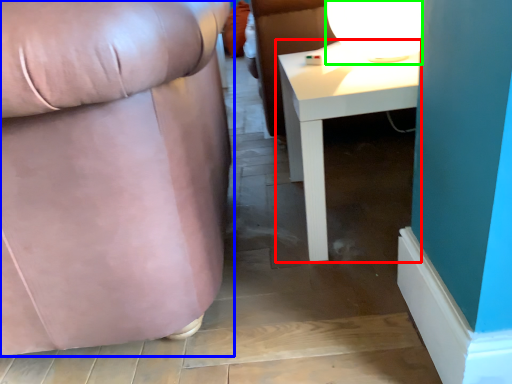
Question: Estimate the real-world distances between objects in this image. Which object is closer to table (highlighted by a red box), chair (highlighted by a blue box) or table lamp (highlighted by a green box)?

Choices:
 (A) chair
 (B) table lamp

Answer: (B)